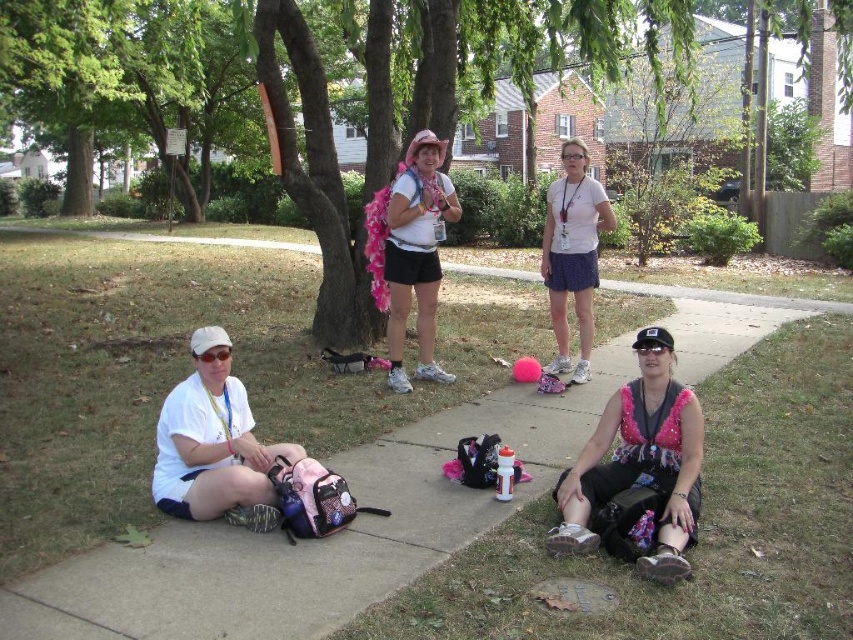
Measure the distance from concrete sidewalk at center to pink sequined top at lower right.

concrete sidewalk at center and pink sequined top at lower right are 1.37 meters apart from each other.

Who is shorter, concrete sidewalk at center or pink sequined top at lower right?

With less height is pink sequined top at lower right.

Which is in front, point (165, 611) or point (689, 417)?

Positioned in front is point (165, 611).

Where is `concrete sidewalk at center`? Image resolution: width=853 pixels, height=640 pixels. concrete sidewalk at center is located at coordinates (314, 541).

Looking at this image, is green grass at lower right thinner than pink sequined top at lower right?

Incorrect, green grass at lower right's width is not less than pink sequined top at lower right's.

The image size is (853, 640). I want to click on green grass at lower right, so click(698, 525).

Locate an element on the screen. The image size is (853, 640). concrete sidewalk at center is located at coordinates (314, 541).

Does concrete sidewalk at center have a greater height compared to white cotton shirt at center?

No, concrete sidewalk at center is not taller than white cotton shirt at center.

Where is `concrete sidewalk at center`? The width and height of the screenshot is (853, 640). concrete sidewalk at center is located at coordinates (314, 541).